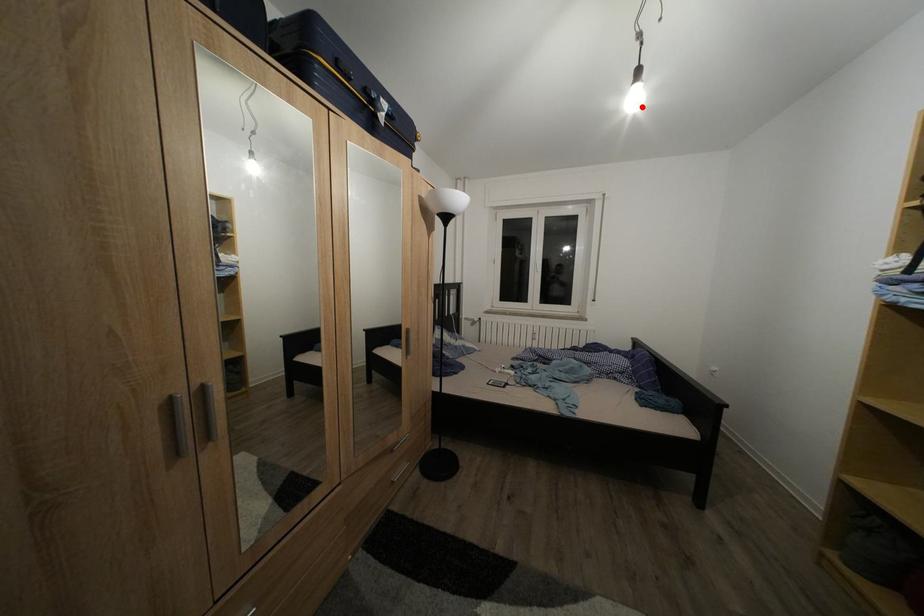
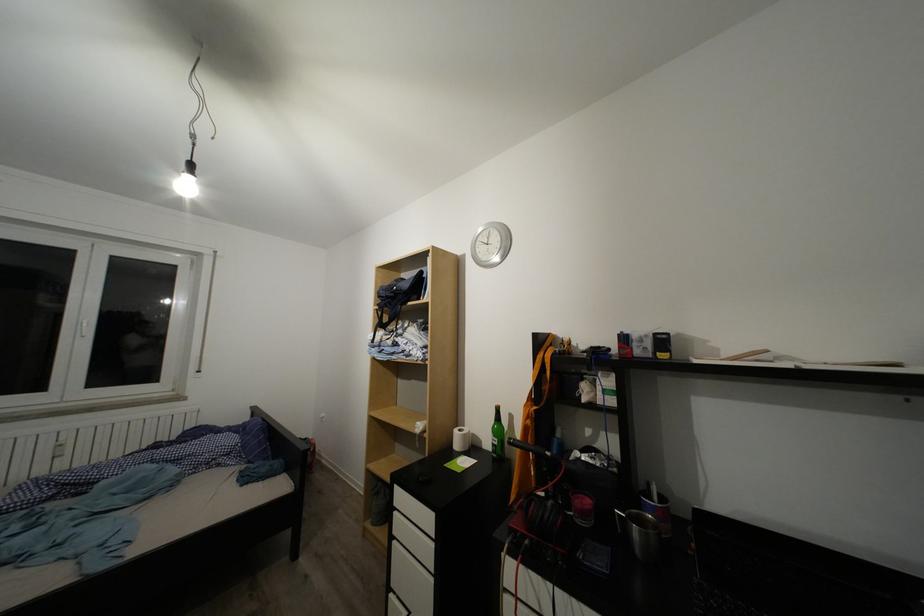
Locate, in the second image, the point that corresponds to the highlighted location in the first image.

(193, 195)